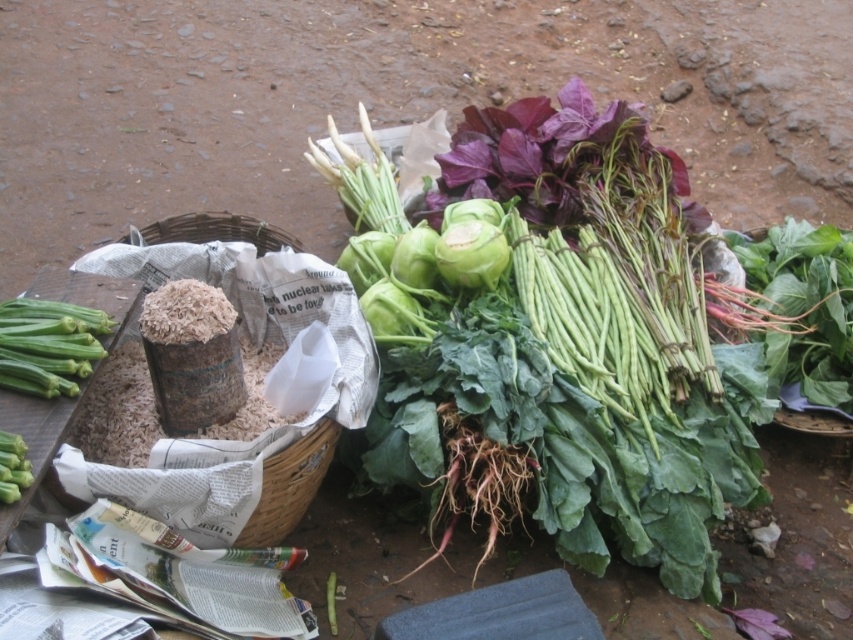
You are setting up a display for a farmers market. You have a green leafy stem at left and a green matte okra at lower left. Which object is wider?

The green leafy stem at left is wider than the green matte okra at lower left because its width surpasses the okra.

In the scene shown: You are a customer at the market and want to pick up both the brown woven basket at left and the green matte okra at lower left. Which item should you reach for first if you want to start with the one closer to the ground?

The brown woven basket at left is located below the green matte okra at lower left, so you should reach for the brown woven basket at left first as it is closer to the ground.